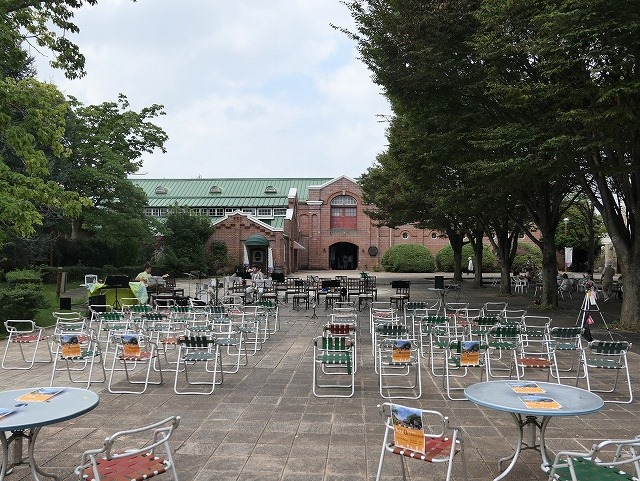
Where is `table`? table is located at coordinates (24, 408), (550, 406).